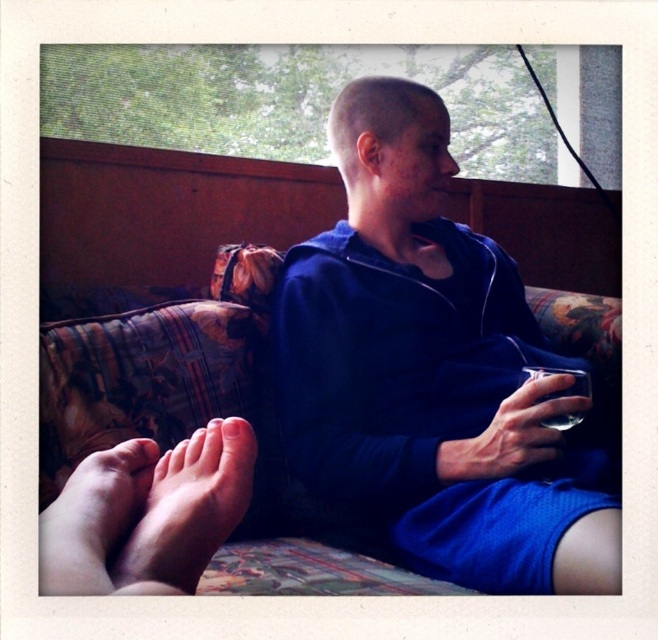
You are a photographer taking a picture of the floral fabric couch at center and the pink soft skin at lower left. Which object is closer to the camera?

The floral fabric couch at center is closer to the camera because the pink soft skin at lower left is behind it.

You are standing in the living room and want to place a small plant pot exactly at the point marked as point [382,417]. If the plant pot has a diameter of 0.5 meters, will it fit comfortably without being too close to the couch or other furniture?

The distance between point [382,417] and the viewer is 1.01 meters. Since the plant pot has a diameter of 0.5 meters, there is sufficient space for it to be placed comfortably at that location without being too close to the couch or other furniture.

You are a photographer taking a picture of the scene. You notice the dry skin feet at lower left and the pink soft skin at lower left in your frame. Which of these two body parts appears taller in the photo?

The dry skin feet at lower left appears taller in the photo because it has a greater height compared to the pink soft skin at lower left.